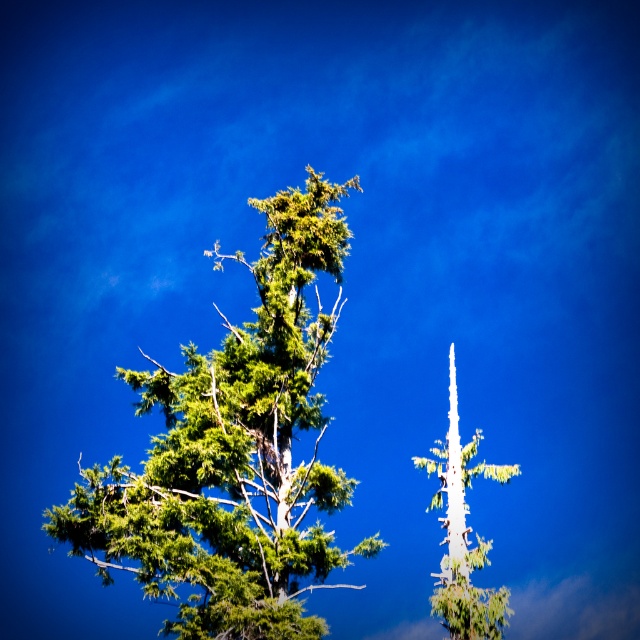
Is green textured tree at center smaller than green matte tree at center?

No, green textured tree at center is not smaller than green matte tree at center.

What do you see at coordinates (234, 451) in the screenshot? The image size is (640, 640). I see `green textured tree at center` at bounding box center [234, 451].

From the picture: Measure the distance between point (x=196, y=636) and camera.

Point (x=196, y=636) is 67.09 meters away from camera.

Where is `green textured tree at center`? green textured tree at center is located at coordinates (234, 451).